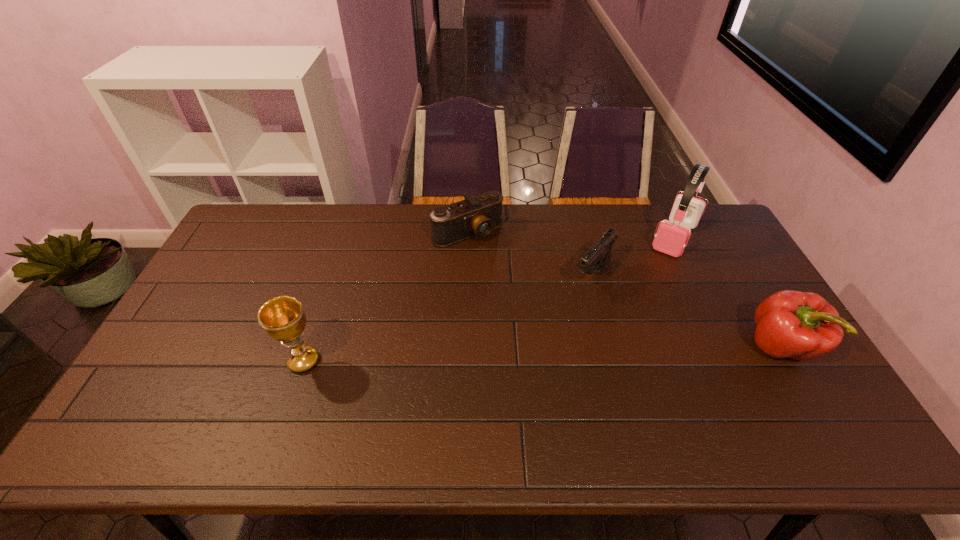
In order to click on unoccupied area between the earphone and the chalice in this screenshot , I will do `click(489, 299)`.

Identify the location of vacant space that is in between the third object from right to left and the leftmost object. (447, 319).

Identify the location of vacant point located between the second object from left to right and the leftmost object. (386, 296).

Image resolution: width=960 pixels, height=540 pixels. Identify the location of vacant space that's between the pepper and the third object from right to left. (686, 313).

Find the location of a particular element. The image size is (960, 540). empty space that is in between the tallest object and the shortest object is located at coordinates (571, 235).

The image size is (960, 540). I want to click on free space that is in between the pepper and the tallest object, so (x=727, y=292).

Identify the location of unoccupied area between the third object from left to right and the chalice. The width and height of the screenshot is (960, 540). (447, 319).

Identify the location of unoccupied position between the pepper and the second object from left to right. (624, 289).

Select which object appears as the second closest to the pepper. Please provide its 2D coordinates. Your answer should be formatted as a tuple, i.e. [(x, y)], where the tuple contains the x and y coordinates of a point satisfying the conditions above.

[(597, 259)]

The height and width of the screenshot is (540, 960). Find the location of `object that ranks as the fourth closest to the pepper`. object that ranks as the fourth closest to the pepper is located at coordinates (283, 318).